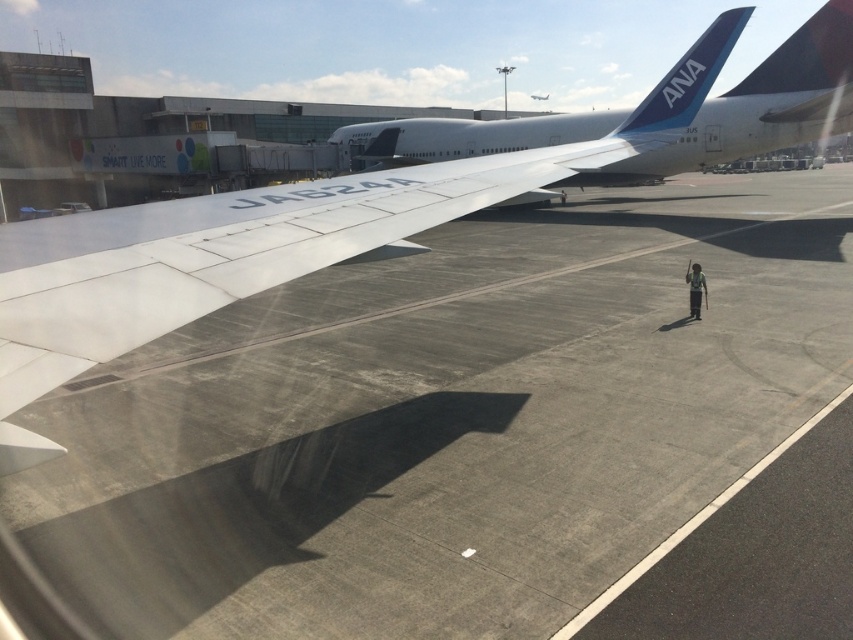
Is green fabric pants at center smaller than green fabric person at center?

Yes.

Which is more to the left, green fabric pants at center or green fabric person at center?

From the viewer's perspective, green fabric pants at center appears more on the left side.

Who is more distant from viewer, (691, 291) or (561, 189)?

Point (561, 189)

Find the location of a particular element. green fabric pants at center is located at coordinates (695, 289).

Where is `gray concrete runway at center`? The width and height of the screenshot is (853, 640). gray concrete runway at center is located at coordinates (445, 420).

Between gray concrete runway at center and white matte wing at center, which one has less height?

white matte wing at center

This screenshot has width=853, height=640. I want to click on gray concrete runway at center, so click(445, 420).

Image resolution: width=853 pixels, height=640 pixels. I want to click on gray concrete runway at center, so click(445, 420).

What do you see at coordinates (445, 420) in the screenshot?
I see `gray concrete runway at center` at bounding box center [445, 420].

This screenshot has width=853, height=640. Find the location of `gray concrete runway at center`. gray concrete runway at center is located at coordinates (445, 420).